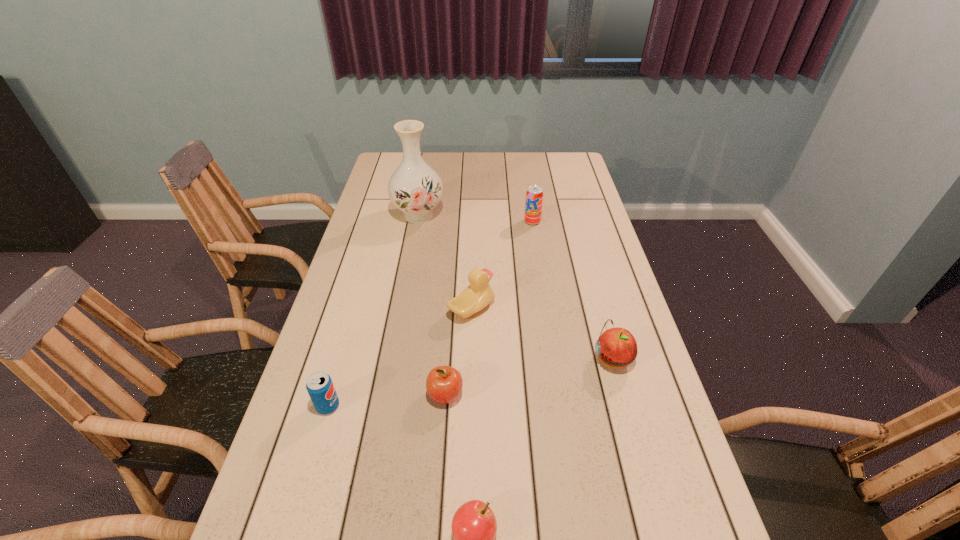
Where is `vacant region located on the right of the second object from left to right`? The image size is (960, 540). vacant region located on the right of the second object from left to right is located at coordinates (527, 216).

At what (x,y) coordinates should I click in order to perform the action: click on vacant space located on the front of the farther soda can. Please return your answer as a coordinate pair (x, y). Looking at the image, I should click on (541, 281).

Identify the location of free space located 0.090m at the beak of the duck. (526, 309).

Identify the location of vacant space located 0.120m on the left of the fourth farthest object. The height and width of the screenshot is (540, 960). (547, 359).

Identify the location of free space located on the right of the second nearest apple. (514, 395).

The width and height of the screenshot is (960, 540). Identify the location of free space located on the back of the nearer soda can. (362, 289).

Where is `vase located in the left edge section of the desktop`? This screenshot has height=540, width=960. vase located in the left edge section of the desktop is located at coordinates (415, 188).

The height and width of the screenshot is (540, 960). Find the location of `soda can present at the left edge`. soda can present at the left edge is located at coordinates (321, 390).

The image size is (960, 540). In order to click on object at the right edge in this screenshot , I will do `click(617, 347)`.

The height and width of the screenshot is (540, 960). What are the coordinates of `blank space at the far edge of the desktop` in the screenshot? It's located at (527, 176).